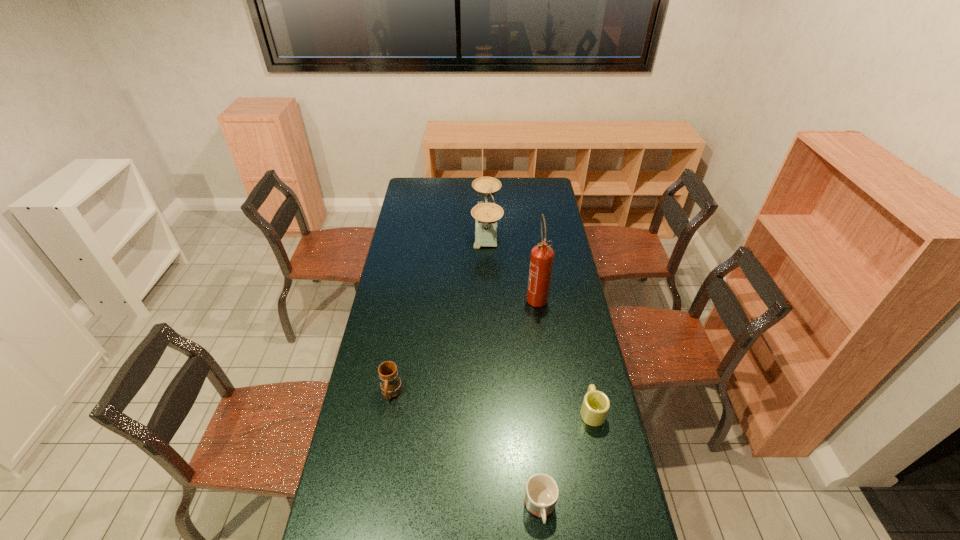
At what (x,y) coordinates should I click in order to perform the action: click on blank space that satisfies the following two spatial constraints: 1. on the front-facing side of the farthest object; 2. with the handle on the side of the rightmost object. Please return your answer as a coordinate pair (x, y). Looking at the image, I should click on (490, 410).

The image size is (960, 540). Find the location of `vacant position in the image that satisfies the following two spatial constraints: 1. on the front-facing side of the fourth shortest object; 2. on the side of the leftmost object with the handle`. vacant position in the image that satisfies the following two spatial constraints: 1. on the front-facing side of the fourth shortest object; 2. on the side of the leftmost object with the handle is located at coordinates (490, 393).

This screenshot has height=540, width=960. I want to click on vacant space that satisfies the following two spatial constraints: 1. with the handle on the side of the rightmost mug; 2. on the front-facing side of the scale, so click(x=553, y=228).